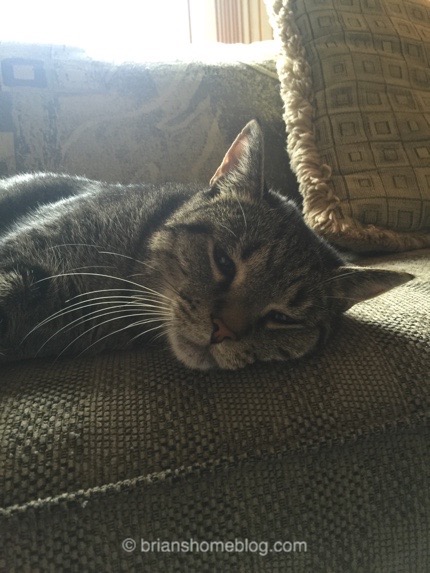
The image size is (430, 573). I want to click on couch cushion, so click(123, 430).